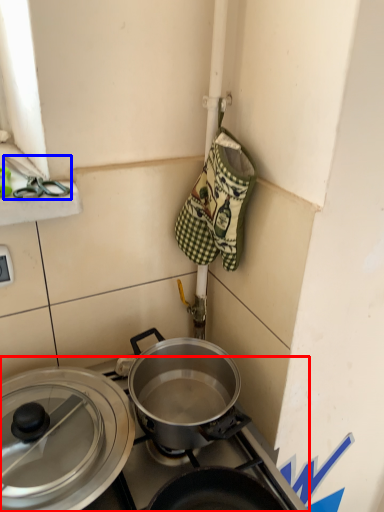
Question: Which point is further to the camera, gas stove (highlighted by a red box) or scissors (highlighted by a blue box)?

Choices:
 (A) gas stove
 (B) scissors

Answer: (A)